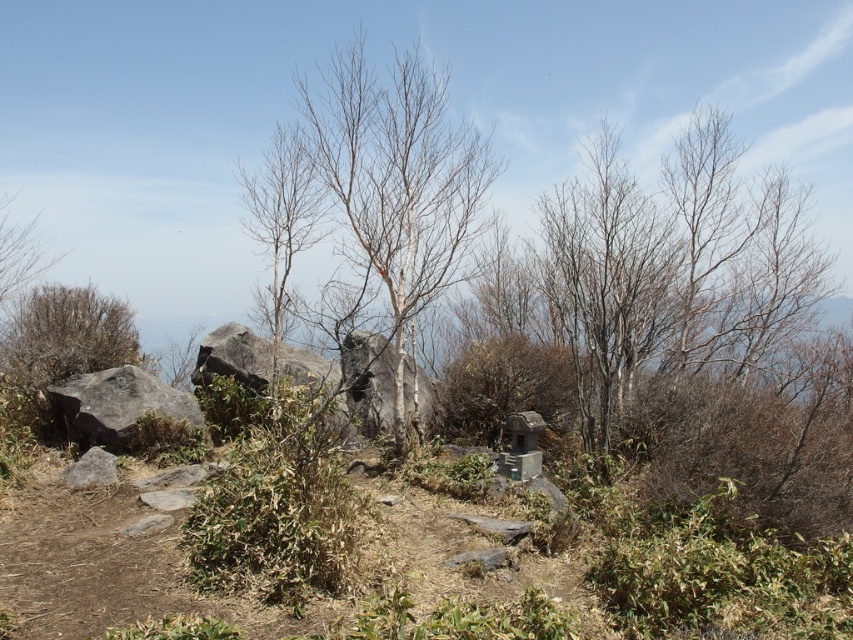
Question: Which object is closer to the camera taking this photo?

Choices:
 (A) bare wood tree at center
 (B) gray rough boulder at left

Answer: (A)

Question: Which point is farther to the camera?

Choices:
 (A) brown shrub at left
 (B) gray rough boulder at left
 (C) bare branches at left

Answer: (C)

Question: Based on their relative distances, which object is nearer to the brown shrub at left?

Choices:
 (A) bare wood tree at center
 (B) gray rough boulder at left
 (C) bare branches at left

Answer: (B)

Question: Is brown shrub at left below gray rough boulder at left?

Choices:
 (A) yes
 (B) no

Answer: (B)

Question: Where is bare wood tree at center located in relation to brown shrub at left in the image?

Choices:
 (A) above
 (B) below

Answer: (A)

Question: Where is bare wood tree at center located in relation to brown shrub at left in the image?

Choices:
 (A) left
 (B) right

Answer: (B)